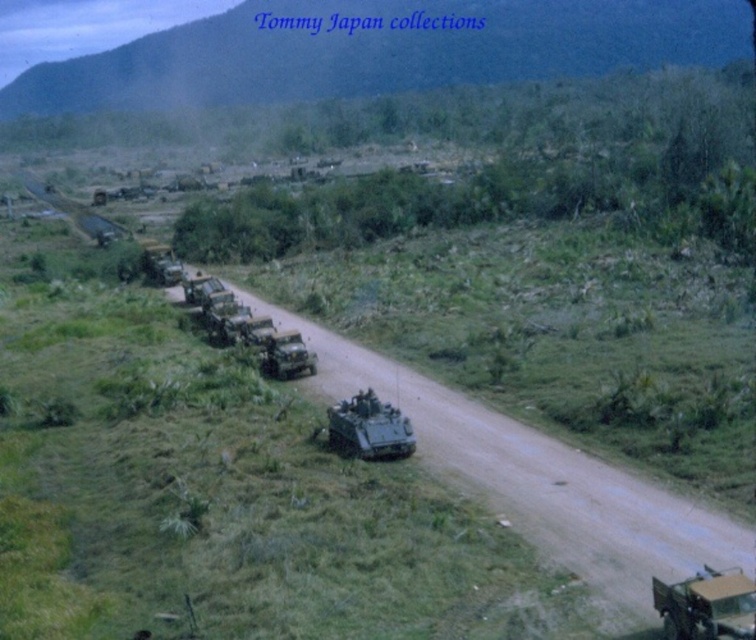
Question: Which object is farther from the camera taking this photo?

Choices:
 (A) matte green jeep at center
 (B) green matte military truck at center

Answer: (B)

Question: Where is matte green tank at center located in relation to matte green armored vehicle at center in the image?

Choices:
 (A) left
 (B) right

Answer: (B)

Question: Does matte green tank at center appear on the right side of matte green armored vehicle at center?

Choices:
 (A) no
 (B) yes

Answer: (B)

Question: Is matte green tank at center behind matte green jeep at center?

Choices:
 (A) yes
 (B) no

Answer: (B)

Question: Considering the real-world distances, which object is closest to the matte green tank at center?

Choices:
 (A) green matte military truck at center
 (B) matte green armored vehicle at center

Answer: (B)

Question: Among these objects, which one is farthest from the camera?

Choices:
 (A) brown dirt track at center
 (B) green matte military truck at center
 (C) camouflage fabric jeep at center
 (D) matte green jeep at center

Answer: (B)